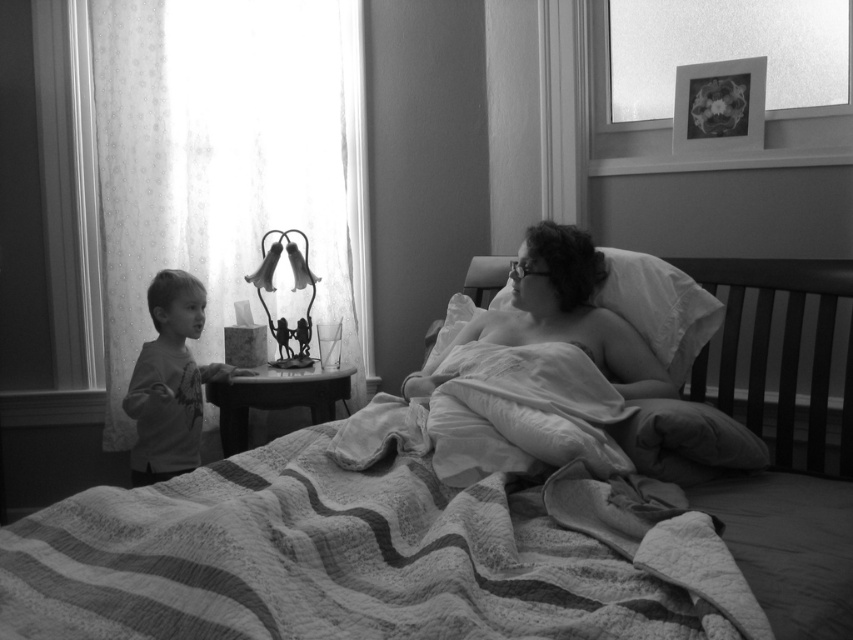
Question: Which point is farther from the camera taking this photo?

Choices:
 (A) (245, 557)
 (B) (282, 243)
 (C) (556, 244)
 (D) (170, 353)

Answer: (B)

Question: Is soft fabric pillow at center thinner than smooth gray shirt at left?

Choices:
 (A) yes
 (B) no

Answer: (B)

Question: Does striped quilted bed at center have a larger size compared to smooth gray shirt at left?

Choices:
 (A) no
 (B) yes

Answer: (B)

Question: Can you confirm if soft fabric pillow at center is wider than smooth gray shirt at left?

Choices:
 (A) no
 (B) yes

Answer: (B)

Question: Which object appears farthest from the camera in this image?

Choices:
 (A) metallic wire lamp at center
 (B) smooth gray shirt at left
 (C) soft fabric pillow at center
 (D) striped quilted bed at center

Answer: (A)

Question: Which point is closer to the camera taking this photo?

Choices:
 (A) (206, 512)
 (B) (258, 276)
 (C) (589, 336)
 (D) (144, 454)

Answer: (A)